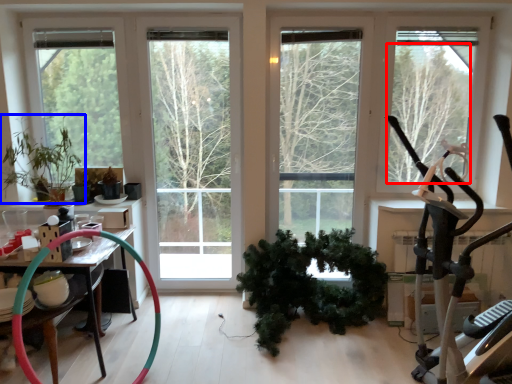
Question: Among these objects, which one is nearest to the camera, tree (highlighted by a red box) or houseplant (highlighted by a blue box)?

Choices:
 (A) tree
 (B) houseplant

Answer: (B)